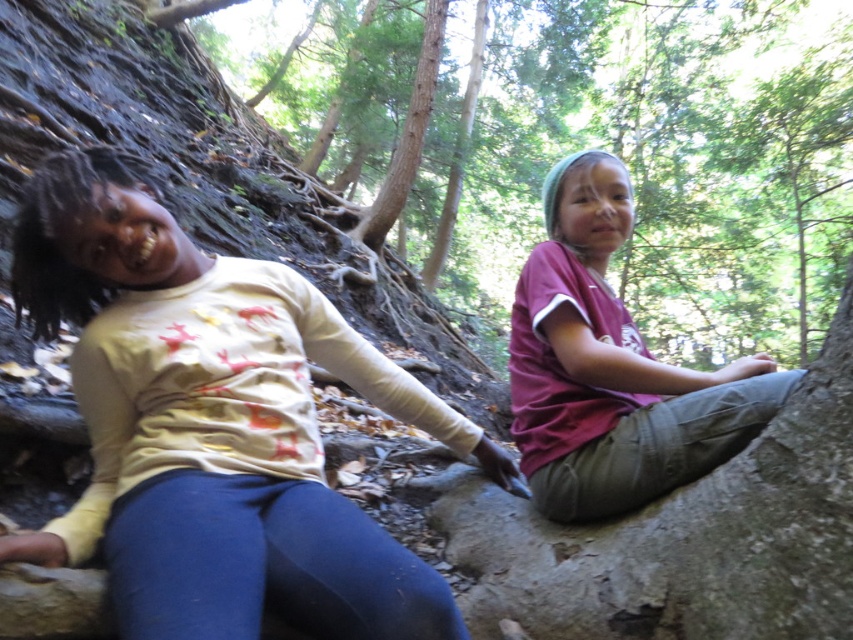
Question: Does green leafy tree at upper center appear over white cotton shirt at left?

Choices:
 (A) yes
 (B) no

Answer: (A)

Question: Which of the following is the closest to the observer?

Choices:
 (A) (252, 336)
 (B) (699, 406)

Answer: (B)

Question: Is green leafy tree at upper center to the right of maroon fabric shirt at center from the viewer's perspective?

Choices:
 (A) yes
 (B) no

Answer: (B)

Question: Among these points, which one is farthest from the camera?

Choices:
 (A) (639, 163)
 (B) (561, 253)
 (C) (341, 336)

Answer: (A)

Question: Is white cotton shirt at left to the right of maroon fabric shirt at center from the viewer's perspective?

Choices:
 (A) no
 (B) yes

Answer: (A)

Question: Which point appears closest to the camera in this image?

Choices:
 (A) click(515, 180)
 (B) click(74, 544)

Answer: (B)